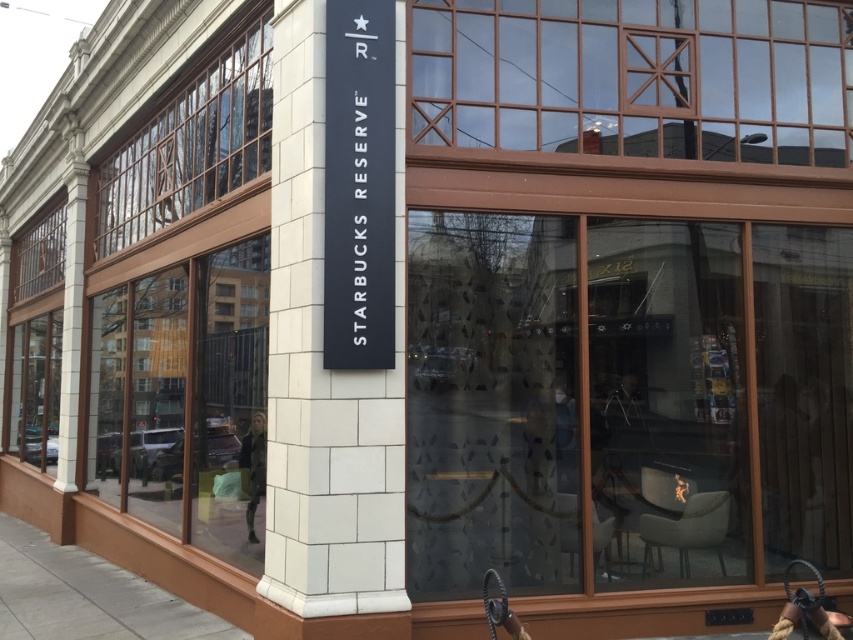
You are standing outside the Starbucks Reserve coffee shop and see the gray concrete pavement at lower left and the green fabric jacket at center. Which object takes up more space in the image?

The green fabric jacket at center takes up more space in the image because the gray concrete pavement at lower left has a smaller size compared to it.

You are standing at the entrance of the Starbucks Reserve coffee shop and see the gray concrete pavement at lower left and the green fabric jacket at center. Which object is located to the left of the other?

The gray concrete pavement at lower left is to the left of the green fabric jacket at center.

You are a delivery person standing on the gray concrete pavement at lower left and need to place a package on the green fabric jacket at center. Can you reach the jacket without climbing anything?

The gray concrete pavement at lower left has a lesser height compared to green fabric jacket at center, so yes, you can reach the jacket without needing to climb anything since the jacket is higher up.